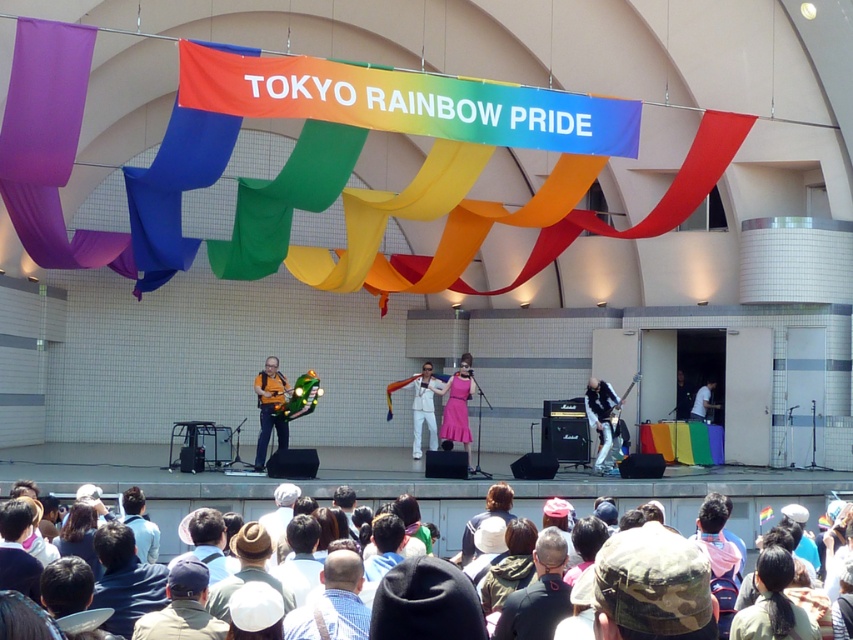
You are an event organizer at the Tokyo Rainbow Pride event. You need to decide which item to place first in the center of the stage. The items are the dark gray fabric jacket at center and the orange fabric at center. Based on their sizes, which one should you place first to ensure proper arrangement?

The dark gray fabric jacket at center is smaller than the orange fabric at center. Since it is smaller, you should place the dark gray fabric jacket at center first to ensure it fits well within the designated area before placing the larger orange fabric at center.

You are a photographer at the event and want to capture both the dark gray fabric jacket at center and the orange fabric at center in a single shot. Which object should you position closer to the left side of your camera frame to ensure both are visible?

To ensure both the dark gray fabric jacket at center and the orange fabric at center are visible in your shot, position the orange fabric at center closer to the left side of your camera frame since the dark gray fabric jacket at center is already on the right side of the orange fabric at center.

You are at the Tokyo Rainbow Pride event and notice a dark gray fabric jacket at center. Where exactly is this jacket positioned relative to the stage and the tiled wall?

The dark gray fabric jacket at center is located at point coordinates 0.928 along the horizontal axis and 0.632 along the vertical axis, placing it towards the lower right area of the stage area near the tiled wall.